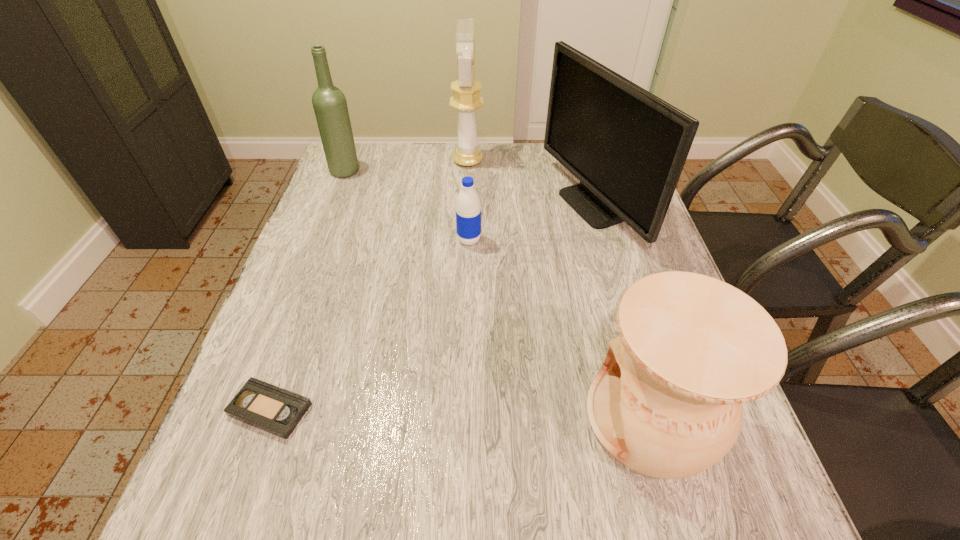
This screenshot has width=960, height=540. In order to click on object that is the third closest to the wine bottle in this screenshot , I will do `click(627, 147)`.

Image resolution: width=960 pixels, height=540 pixels. What are the coordinates of `object that is the fourth closest to the award` in the screenshot? It's located at (667, 403).

Identify the location of free spot that satisfies the following two spatial constraints: 1. on the front-facing side of the award; 2. on the front side of the shortest object. (459, 409).